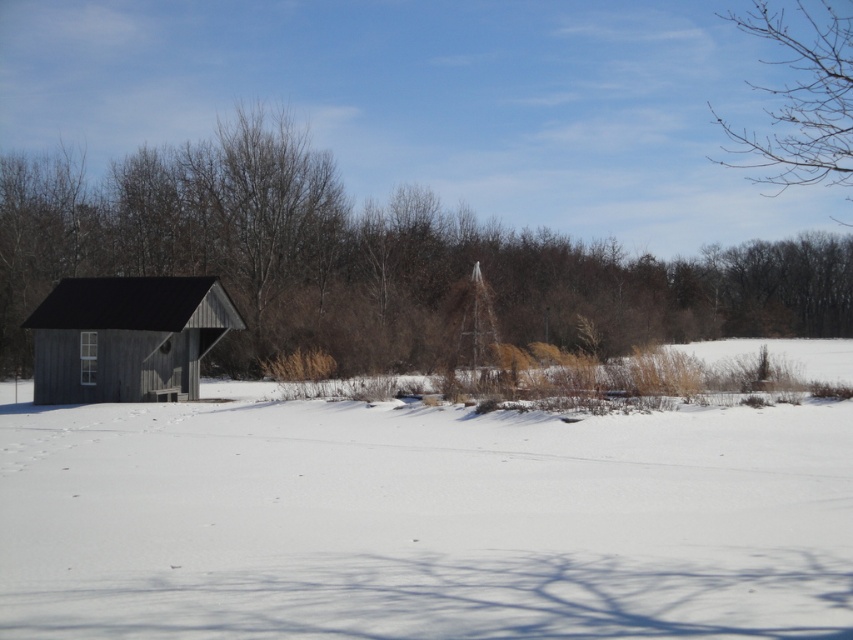
In the scene shown: Looking at the winter scene, where is the white fluffy snow at center in relation to the bare branches at upper right?

The white fluffy snow at center is located to the left of the bare branches at upper right.